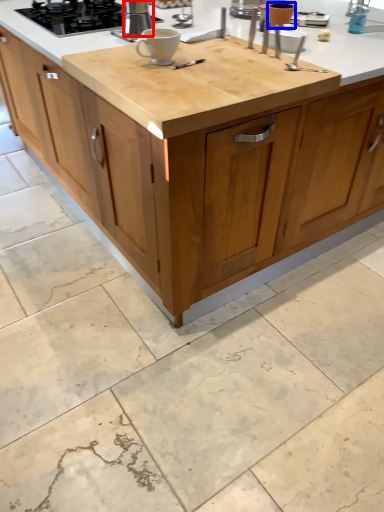
Question: Among these objects, which one is nearest to the camera, kitchen appliance (highlighted by a red box) or appliance (highlighted by a blue box)?

Choices:
 (A) kitchen appliance
 (B) appliance

Answer: (A)